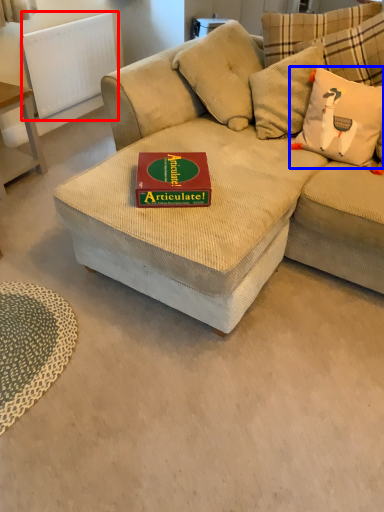
Question: Which object appears closest to the camera in this image, radiator (highlighted by a red box) or throw pillow (highlighted by a blue box)?

Choices:
 (A) radiator
 (B) throw pillow

Answer: (B)